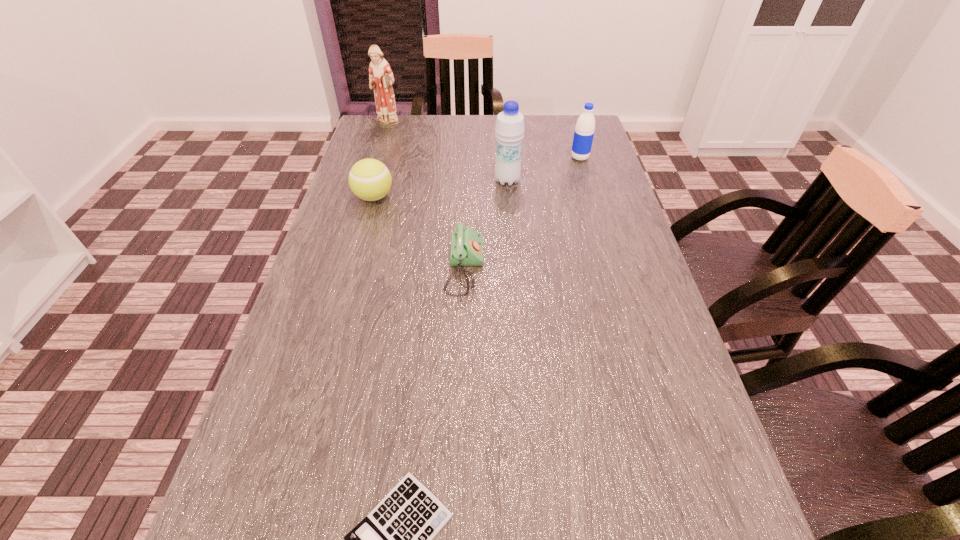
The image size is (960, 540). In order to click on free space at the right edge of the desktop in this screenshot , I will do `click(716, 464)`.

Where is `vacant area between the telephone and the right water bottle`? The width and height of the screenshot is (960, 540). vacant area between the telephone and the right water bottle is located at coordinates (522, 213).

Locate an element on the screen. blank region between the fourth shortest object and the fifth tallest object is located at coordinates (522, 213).

At what (x,y) coordinates should I click in order to perform the action: click on free space between the fifth tallest object and the figurine. Please return your answer as a coordinate pair (x, y). This screenshot has height=540, width=960. Looking at the image, I should click on (426, 198).

I want to click on blank region between the nearer water bottle and the farthest object, so click(x=447, y=154).

Identify the location of free space between the fourth tallest object and the left water bottle. tap(441, 189).

Locate an element on the screen. Image resolution: width=960 pixels, height=540 pixels. the fourth closest object to the farther water bottle is located at coordinates (381, 78).

Identify the location of the second closest object relative to the fifth tallest object. The image size is (960, 540). (509, 130).

Identify the location of free spot that satisfies the following two spatial constraints: 1. on the front-facing side of the fifth object from left to right; 2. on the right side of the farthest object. (371, 180).

Identify the location of vacant space that satisfies the following two spatial constraints: 1. on the front side of the shorter water bottle; 2. on the dial of the second nearest object. (612, 268).